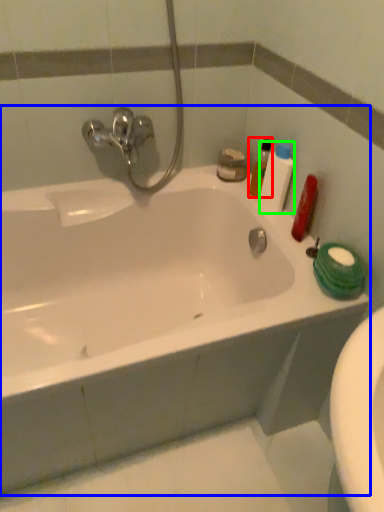
Question: Which object is positioned farthest from cleaning product (highlighted by a red box)? Select from bathtub (highlighted by a blue box) and toiletry (highlighted by a green box).

Choices:
 (A) bathtub
 (B) toiletry

Answer: (A)